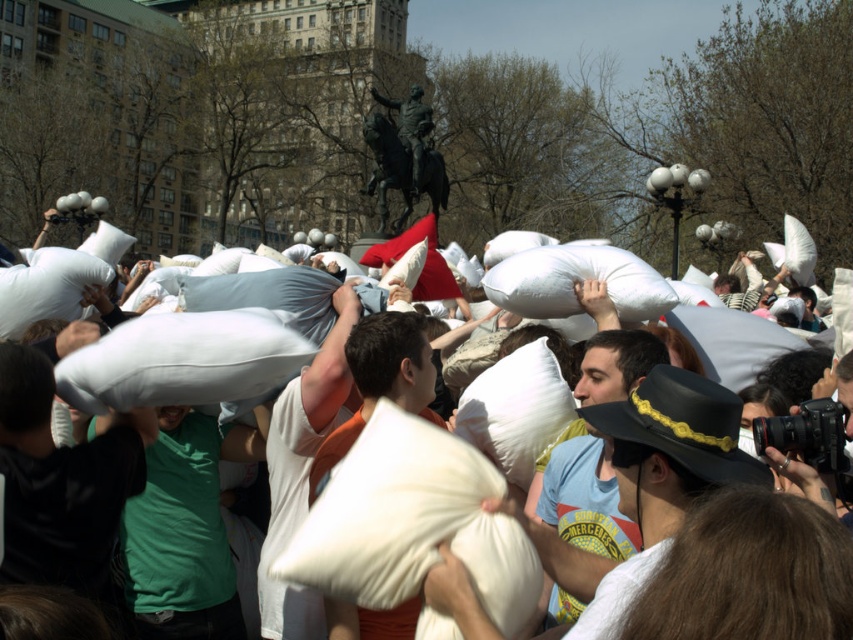
Identify the location of black matte pillow at center. (62, 484).

Can you confirm if black matte pillow at center is smaller than matte white pillow at center?

Yes.

Where is `black matte pillow at center`? The height and width of the screenshot is (640, 853). black matte pillow at center is located at coordinates (62, 484).

Where is `white soft pillows at center`? The image size is (853, 640). white soft pillows at center is located at coordinates (180, 346).

The height and width of the screenshot is (640, 853). Describe the element at coordinates (180, 346) in the screenshot. I see `white soft pillows at center` at that location.

The image size is (853, 640). Identify the location of white soft pillows at center. (180, 346).

Which is more to the left, matte black hat at center or matte white pillow at center?

From the viewer's perspective, matte black hat at center appears more on the left side.

Who is lower down, matte black hat at center or matte white pillow at center?

matte black hat at center

Describe the element at coordinates (648, 481) in the screenshot. I see `matte black hat at center` at that location.

Where is `matte black hat at center`? This screenshot has width=853, height=640. matte black hat at center is located at coordinates (648, 481).